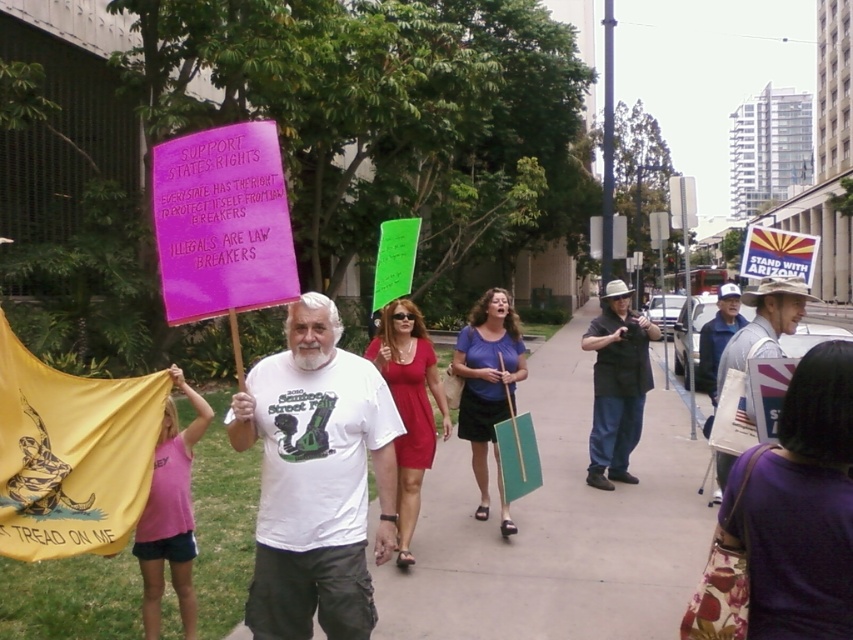
Question: Which point is closer to the camera?

Choices:
 (A) white cowboy hat at center
 (B) concrete sidewalk at center

Answer: (A)

Question: Is yellow fabric flag at lower left smaller than white cowboy hat at center?

Choices:
 (A) no
 (B) yes

Answer: (B)

Question: Which of the following is the farthest from the observer?

Choices:
 (A) white cotton t-shirt at center
 (B) white cowboy hat at center
 (C) yellow fabric flag at lower left

Answer: (B)

Question: Which object appears farthest from the camera in this image?

Choices:
 (A) black matte shirt at center
 (B) yellow fabric flag at lower left
 (C) white cowboy hat at center

Answer: (A)

Question: Does concrete sidewalk at center appear on the left side of white cotton t-shirt at center?

Choices:
 (A) yes
 (B) no

Answer: (B)

Question: Can you confirm if concrete sidewalk at center is positioned to the left of white cowboy hat at center?

Choices:
 (A) no
 (B) yes

Answer: (A)